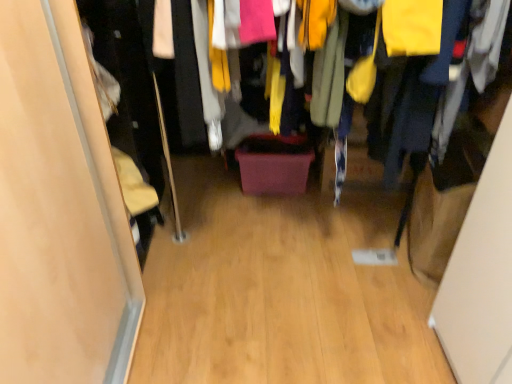
Identify the location of blank space above wooden floor at center (from a real-world perspective). This screenshot has height=384, width=512. (252, 242).